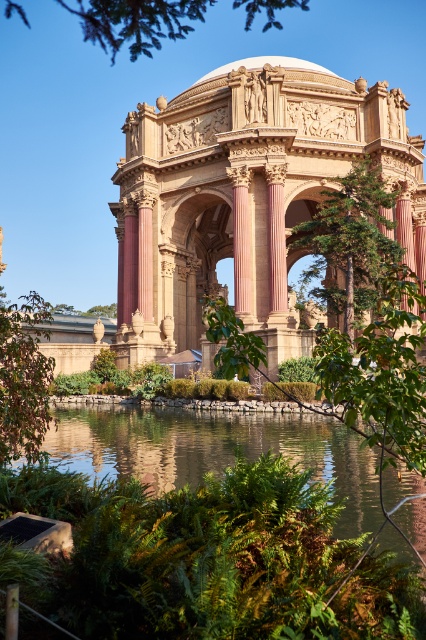
You are standing at the point closer to the bottom of the image and want to walk towards the Palace of Fine Arts. Which point, point [342,525] or point [8,396], is in front of you?

Point [8,396] is in front of you because it is closer to your position at the bottom of the image compared to point [342,525], which is behind it.

You are standing in front of the Palace of Fine Arts and want to take a photo of both the clear water at center and the green leafy tree at upper center. Since you want to include both in the frame, which object should you focus on first to ensure both are in focus?

You should focus on the green leafy tree at upper center first because it is farther away from the viewer than the clear water at center. By focusing on the farther object, you can ensure that both are within the depth of field and in focus.

You are standing in front of the Palace of Fine Arts and want to take a photo that includes both the clear water at center and the green leafy tree at upper center. Which object should you position closer to the edge of your camera frame to ensure both fit in the shot?

The clear water at center has a lesser width compared to the green leafy tree at upper center, so you should position the clear water at center closer to the edge of your camera frame to ensure both fit in the shot.